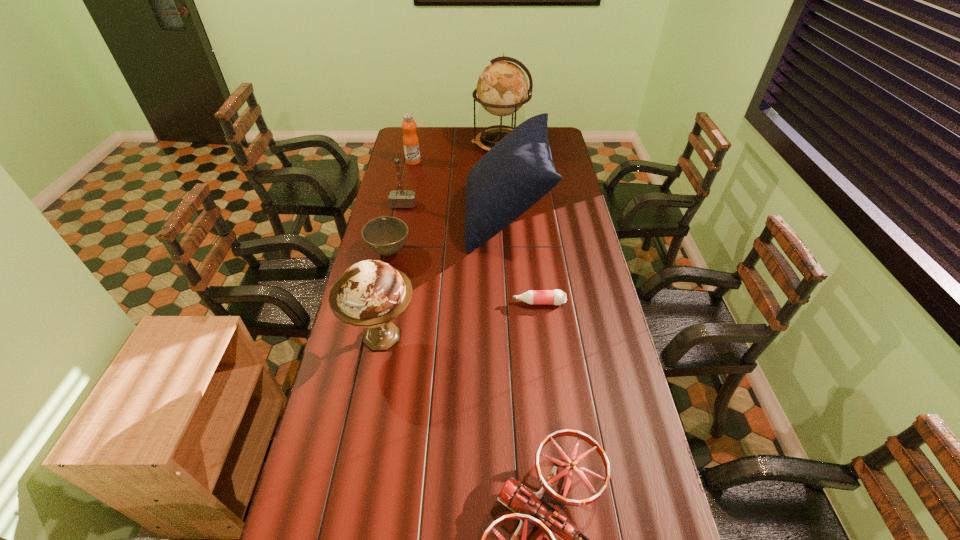
Locate an element on the screen. vacant space at the right edge of the desktop is located at coordinates (569, 198).

Find the location of a particular element. The height and width of the screenshot is (540, 960). free space between the fruit juice and the tallest object is located at coordinates (456, 153).

You are a GUI agent. You are given a task and a screenshot of the screen. Output one action in this format:
    pyautogui.click(x=<x>, y=<y>)
    Task: Click on the empty space that is in between the nearer globe and the cushion
    The height and width of the screenshot is (540, 960).
    Given the screenshot: What is the action you would take?
    pyautogui.click(x=444, y=277)

The image size is (960, 540). I want to click on vacant area between the farther globe and the sixth farthest object, so click(x=519, y=224).

You are a GUI agent. You are given a task and a screenshot of the screen. Output one action in this format:
    pyautogui.click(x=<x>, y=<y>)
    Task: Click on the empty location between the shortest object and the farther globe
    The width and height of the screenshot is (960, 540).
    Given the screenshot: What is the action you would take?
    pyautogui.click(x=519, y=224)

Locate an element on the screen. free space between the fruit juice and the right globe is located at coordinates (456, 153).

Find the location of `object that is the fifth closest one to the sixth farthest object`. object that is the fifth closest one to the sixth farthest object is located at coordinates (400, 198).

Choose which object is the second nearest neighbor to the nearer globe. Please provide its 2D coordinates. Your answer should be formatted as a tuple, i.e. [(x, y)], where the tuple contains the x and y coordinates of a point satisfying the conditions above.

[(541, 508)]

The width and height of the screenshot is (960, 540). Find the location of `vacant space that satisfies the following two spatial constraints: 1. at the center of the right globe; 2. on the striking surface of the hammer`. vacant space that satisfies the following two spatial constraints: 1. at the center of the right globe; 2. on the striking surface of the hammer is located at coordinates (503, 205).

Identify the location of vacant area that satisfies the following two spatial constraints: 1. at the center of the right globe; 2. on the striking surface of the hammer. (503, 205).